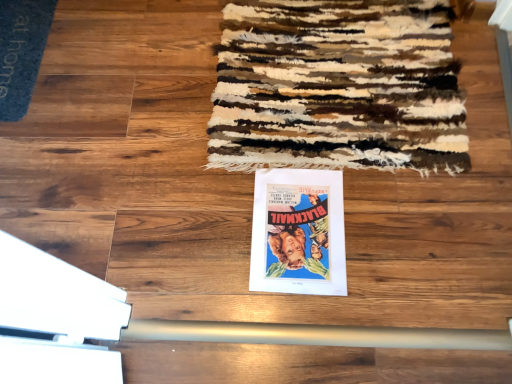
Where is `vacant area that is in front of blue carpet at upper left`? This screenshot has height=384, width=512. vacant area that is in front of blue carpet at upper left is located at coordinates (46, 137).